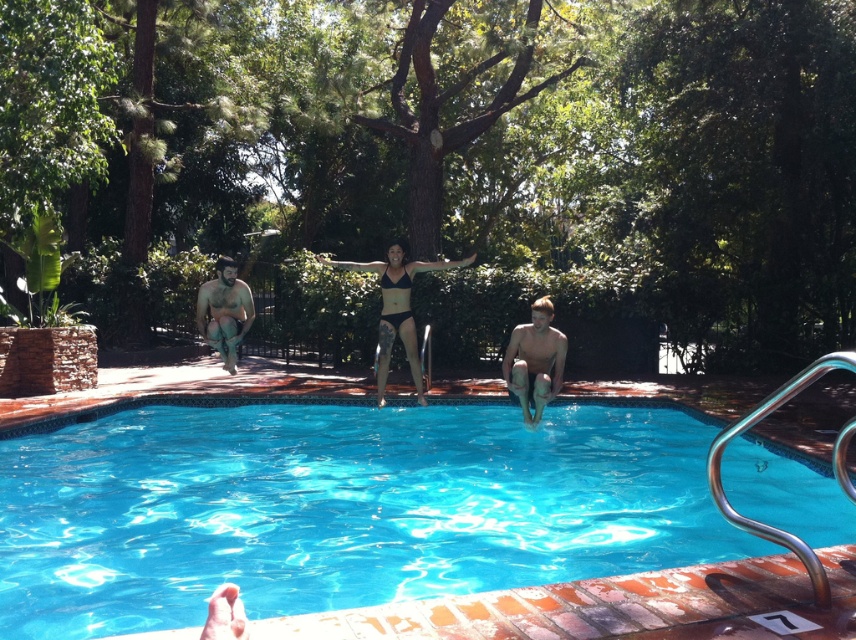
You are a photographer at the poolside. You want to capture a photo where the smooth skin man at center and beige fabric shorts at left are both in frame. Based on their sizes, which object should you zoom in on to ensure both fit in the photo?

The smooth skin man at center has a lesser width compared to beige fabric shorts at left. To ensure both fit in the photo, you should zoom in on the beige fabric shorts at left since it is wider and requires more space in the frame.

In the scene shown: You are a photographer at the pool edge. You want to capture a photo of the smooth skin man at center and the beige fabric shorts at left. Which one is positioned lower in the frame?

The smooth skin man at center is positioned lower in the frame than the beige fabric shorts at left.

You are a swimmer standing at the edge of the pool. You see the blue glossy water at center and the beige fabric shorts at left. Which object is narrower in width?

The blue glossy water at center is thinner than the beige fabric shorts at left, so the blue glossy water at center is narrower in width.